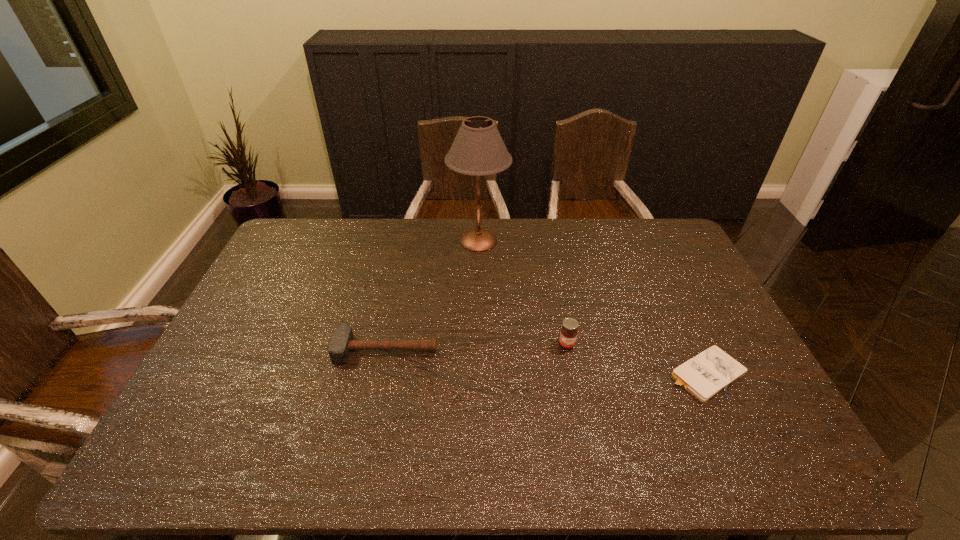
The height and width of the screenshot is (540, 960). I want to click on vacant region between the shortest object and the second object from left to right, so click(x=591, y=307).

This screenshot has height=540, width=960. In order to click on vacant space that is in between the jam and the tallest object in this screenshot , I will do `click(523, 292)`.

At what (x,y) coordinates should I click in order to perform the action: click on free space between the notebook and the third object from left to right. Please return your answer as a coordinate pair (x, y). This screenshot has width=960, height=540. Looking at the image, I should click on (636, 359).

Where is `free space between the second tallest object and the second object from left to right`? The image size is (960, 540). free space between the second tallest object and the second object from left to right is located at coordinates (x=523, y=292).

The height and width of the screenshot is (540, 960). Identify the location of free space between the rightmost object and the second tallest object. (636, 359).

Find the location of `empty location between the third object from right to left and the hammer`. empty location between the third object from right to left and the hammer is located at coordinates (432, 294).

The height and width of the screenshot is (540, 960). Identify the location of free space between the second object from left to right and the third shortest object. (523, 292).

The height and width of the screenshot is (540, 960). What are the coordinates of `vacant space in between the third object from right to left and the shortest object` in the screenshot? It's located at (591, 307).

Identify which object is the second nearest to the second shortest object. Please provide its 2D coordinates. Your answer should be formatted as a tuple, i.e. [(x, y)], where the tuple contains the x and y coordinates of a point satisfying the conditions above.

[(568, 334)]

The image size is (960, 540). I want to click on object that is the third closest to the third object from left to right, so click(x=478, y=149).